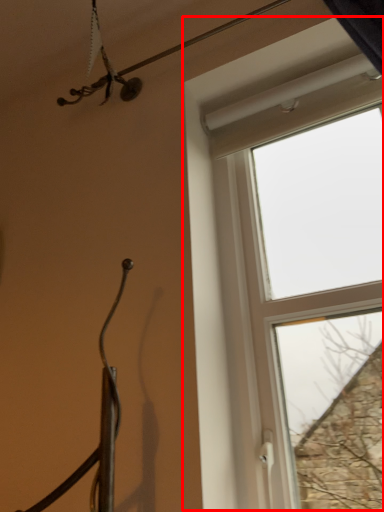
Question: From the image's perspective, what is the correct spatial positioning of window (annotated by the red box) in reference to wire?

Choices:
 (A) above
 (B) below

Answer: (B)